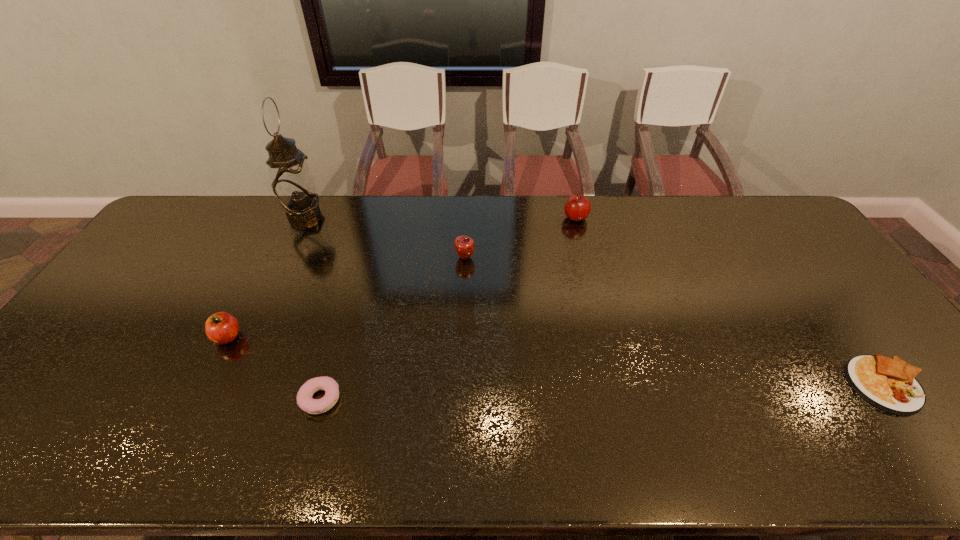
Locate an element on the screen. The height and width of the screenshot is (540, 960). free space that is in between the second shortest object and the oil lamp is located at coordinates (312, 306).

Where is `vacant region between the leftmost apple and the fifth tallest object`? This screenshot has width=960, height=540. vacant region between the leftmost apple and the fifth tallest object is located at coordinates (275, 368).

Image resolution: width=960 pixels, height=540 pixels. Identify the location of free space between the second shortest object and the fourth farthest object. (275, 368).

Where is `free area in between the fourth nearest object and the third nearest object`? The height and width of the screenshot is (540, 960). free area in between the fourth nearest object and the third nearest object is located at coordinates (347, 297).

Identify the location of vacant point located between the omelet and the oil lamp. (595, 299).

Find the location of `empty space between the oil lamp and the third farthest object`. empty space between the oil lamp and the third farthest object is located at coordinates (384, 236).

Where is `object that ranks as the second closest to the third object from right to left`? Image resolution: width=960 pixels, height=540 pixels. object that ranks as the second closest to the third object from right to left is located at coordinates (305, 401).

Select which object appears as the second closest to the omelet. Please provide its 2D coordinates. Your answer should be formatted as a tuple, i.e. [(x, y)], where the tuple contains the x and y coordinates of a point satisfying the conditions above.

[(464, 245)]

You are a GUI agent. You are given a task and a screenshot of the screen. Output one action in this format:
    pyautogui.click(x=<x>, y=<y>)
    Task: Click on the apple that is the second closest to the rightmost apple
    This screenshot has width=960, height=540.
    Given the screenshot: What is the action you would take?
    pyautogui.click(x=221, y=328)

This screenshot has width=960, height=540. Identify the location of apple that stands as the closest to the fifth tallest object. (221, 328).